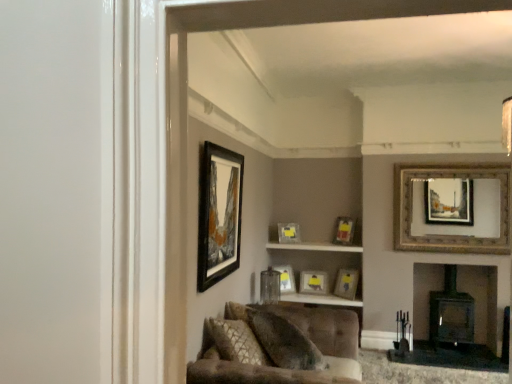
Question: In which direction should I rotate to look at matte glass picture frame at center, the sixth picture frame from the right?

Choices:
 (A) right
 (B) left

Answer: (A)

Question: Can you confirm if gold/gilded picture frame at upper right, which is the 2th picture frame from front to back, is positioned to the left of matte gold picture frame at center, which appears as the sixth picture frame when viewed from the front?

Choices:
 (A) yes
 (B) no

Answer: (B)

Question: Considering the relative positions of gold/gilded picture frame at upper right, the sixth picture frame in the back-to-front sequence, and matte gold picture frame at center, positioned as the second picture frame in back-to-front order, in the image provided, is gold/gilded picture frame at upper right, the sixth picture frame in the back-to-front sequence, behind matte gold picture frame at center, positioned as the second picture frame in back-to-front order,?

Choices:
 (A) yes
 (B) no

Answer: (B)

Question: From the image's perspective, is gold/gilded picture frame at upper right, which is the 2th picture frame from front to back, over matte gold picture frame at center, which is the fourth picture frame from left to right?

Choices:
 (A) no
 (B) yes

Answer: (B)

Question: Considering the relative sizes of gold/gilded picture frame at upper right, the 1th picture frame from the right, and matte gold picture frame at center, which appears as the sixth picture frame when viewed from the front, in the image provided, is gold/gilded picture frame at upper right, the 1th picture frame from the right, bigger than matte gold picture frame at center, which appears as the sixth picture frame when viewed from the front,?

Choices:
 (A) no
 (B) yes

Answer: (B)

Question: From the image's perspective, is gold/gilded picture frame at upper right, the 1th picture frame from the right, located beneath matte gold picture frame at center, which is the fourth picture frame from left to right?

Choices:
 (A) yes
 (B) no

Answer: (B)

Question: Is gold/gilded picture frame at upper right, which ranks as the 7th picture frame in left-to-right order, far from matte gold picture frame at center, positioned as the second picture frame in back-to-front order?

Choices:
 (A) no
 (B) yes

Answer: (B)

Question: Considering the relative positions of matte gold picture frame at center, the first picture frame from the back, and matte gold picture frame at center, acting as the fifth picture frame starting from the left, in the image provided, is matte gold picture frame at center, the first picture frame from the back, in front of matte gold picture frame at center, acting as the fifth picture frame starting from the left,?

Choices:
 (A) no
 (B) yes

Answer: (A)

Question: From a real-world perspective, is matte gold picture frame at center, the seventh picture frame positioned from the front, on top of matte gold picture frame at center, acting as the fifth picture frame starting from the left?

Choices:
 (A) yes
 (B) no

Answer: (B)

Question: Is matte gold picture frame at center, the seventh picture frame positioned from the front, touching matte gold picture frame at center, which is counted as the 4th picture frame, starting from the back?

Choices:
 (A) no
 (B) yes

Answer: (A)

Question: Is matte gold picture frame at center, the seventh picture frame positioned from the front, facing away from matte gold picture frame at center, positioned as the 4th picture frame in front-to-back order?

Choices:
 (A) no
 (B) yes

Answer: (A)

Question: Is matte gold picture frame at center, the first picture frame from the back, completely or partially outside of matte gold picture frame at center, which is counted as the 4th picture frame, starting from the back?

Choices:
 (A) no
 (B) yes

Answer: (B)

Question: Is the depth of matte gold picture frame at center, which is counted as the 5th picture frame, starting from the right, greater than that of matte gold picture frame at center, positioned as the 4th picture frame in front-to-back order?

Choices:
 (A) yes
 (B) no

Answer: (A)

Question: Is matte gold picture frame at center, which is counted as the 4th picture frame, starting from the back, at the left side of black matte picture frame at upper center, the 7th picture frame when ordered from back to front?

Choices:
 (A) no
 (B) yes

Answer: (A)